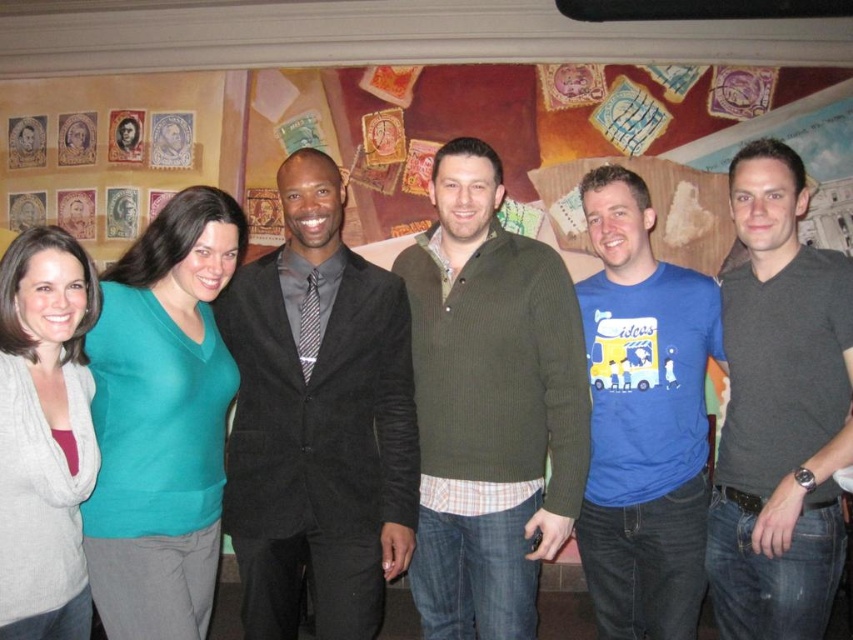
Question: Does suede black suit at center appear on the right side of teal matte sweater at left?

Choices:
 (A) yes
 (B) no

Answer: (A)

Question: Which object is the farthest from the teal matte sweater at left?

Choices:
 (A) gray knit cardigan at left
 (B) dark gray shirt at center
 (C) blue cotton t-shirt at center
 (D) suede black suit at center

Answer: (B)

Question: Which is farther from the suede black suit at center?

Choices:
 (A) olive-green sweater at center
 (B) teal matte sweater at left

Answer: (A)

Question: Which point is farther from the camera taking this photo?

Choices:
 (A) (799, 212)
 (B) (123, 454)
 (C) (9, 596)

Answer: (A)

Question: Is blue cotton t-shirt at center wider than gray knit cardigan at left?

Choices:
 (A) no
 (B) yes

Answer: (B)

Question: Does suede black suit at center have a smaller size compared to dark gray shirt at center?

Choices:
 (A) yes
 (B) no

Answer: (B)